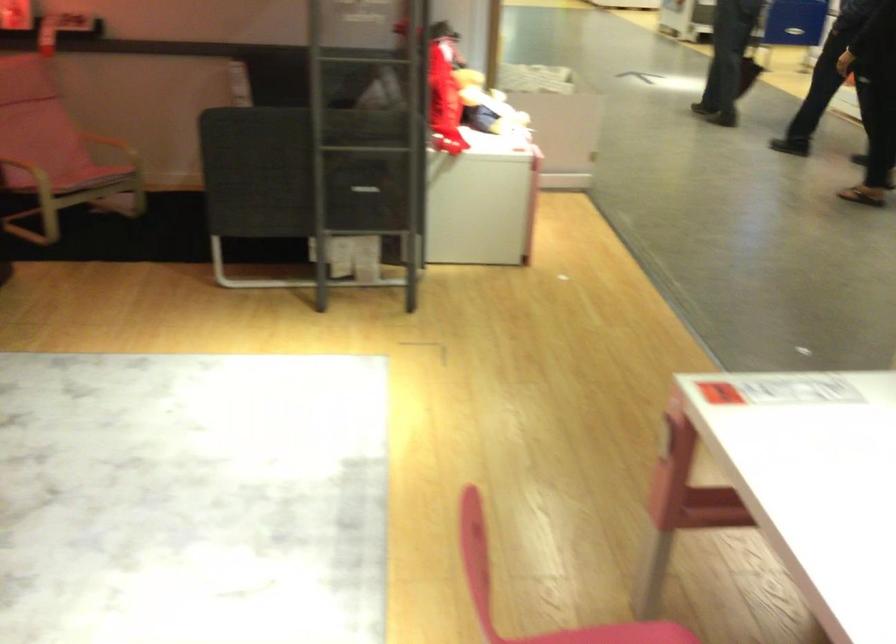
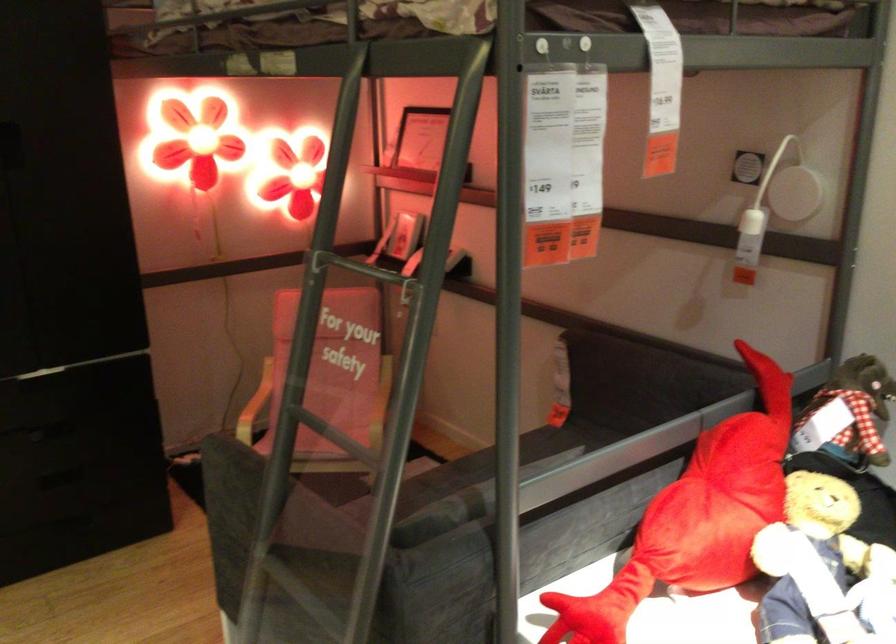
In the second image, find the point that corresponds to point (464, 84) in the first image.

(719, 502)